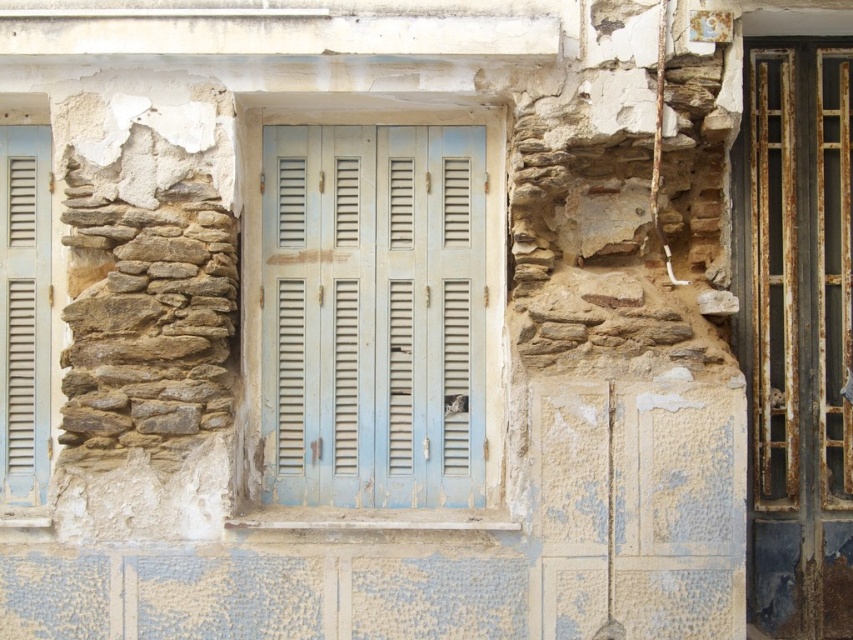
Looking at this image, is light blue wooden shutters at center smaller than matte blue shutters at left?

Incorrect, light blue wooden shutters at center is not smaller in size than matte blue shutters at left.

Is point (434, 237) farther from viewer compared to point (45, 337)?

No, (434, 237) is in front of (45, 337).

Image resolution: width=853 pixels, height=640 pixels. I want to click on light blue wooden shutters at center, so click(x=373, y=314).